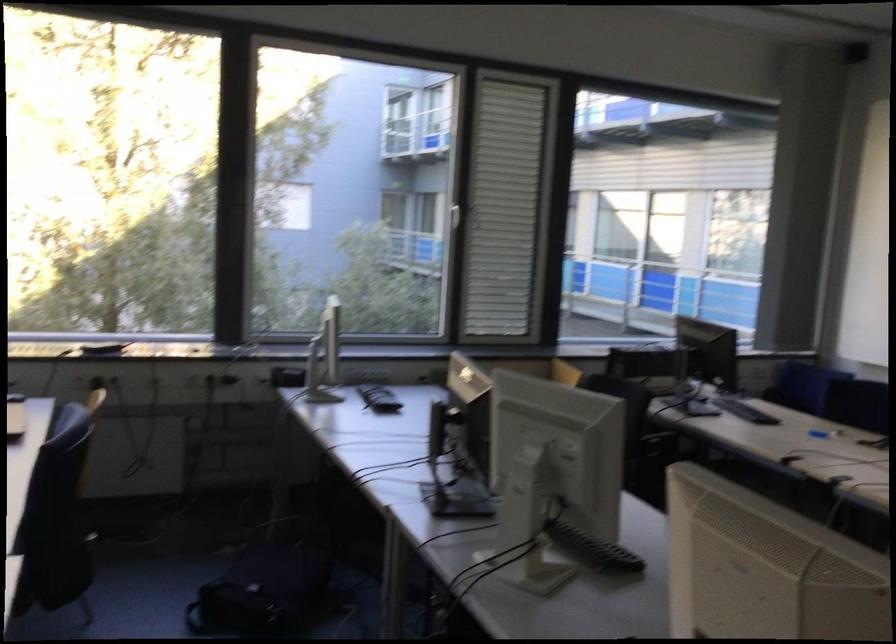
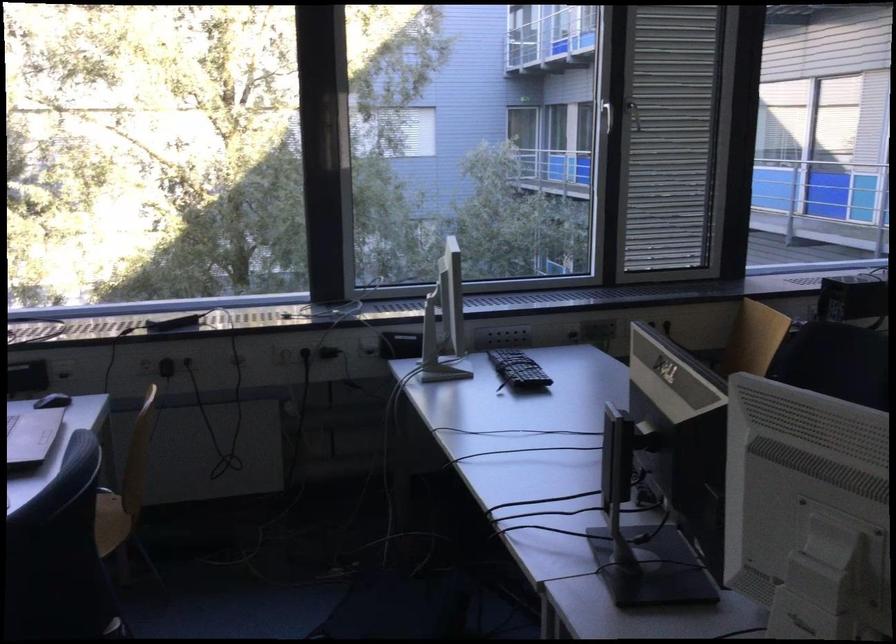
Where in the second image is the point corresponding to the point at 192,373 from the first image?

(285, 354)